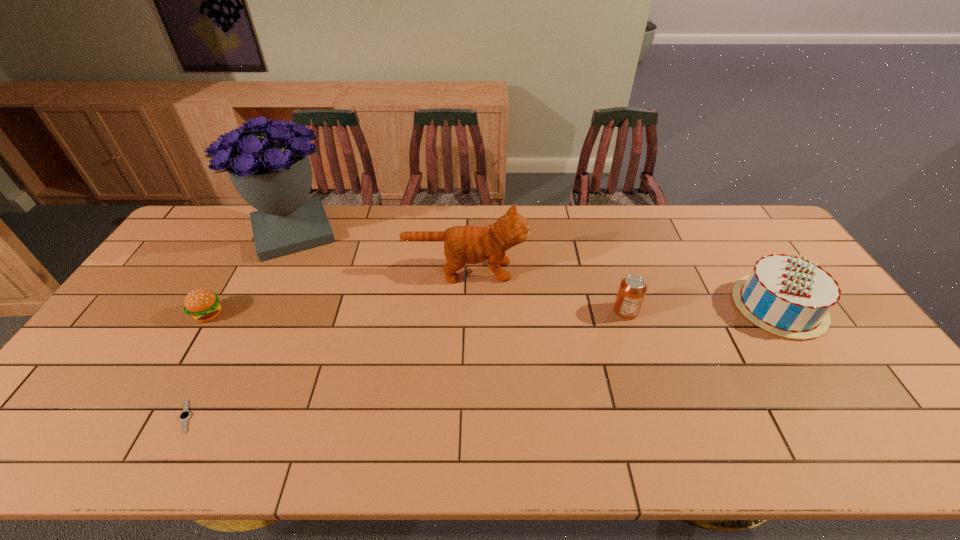
What are the coordinates of `the tallest object` in the screenshot? It's located at coord(272,173).

The height and width of the screenshot is (540, 960). I want to click on the second tallest object, so click(463, 245).

Where is `the third object from right to left`? Image resolution: width=960 pixels, height=540 pixels. the third object from right to left is located at coordinates (463, 245).

What are the coordinates of `the fourth shortest object` in the screenshot? It's located at (788, 296).

Where is `birthday cake`? The height and width of the screenshot is (540, 960). birthday cake is located at coordinates (788, 296).

At what (x,y) coordinates should I click in order to perform the action: click on can. Please return your answer as a coordinate pair (x, y). Image resolution: width=960 pixels, height=540 pixels. Looking at the image, I should click on (632, 290).

Where is `the fourth tallest object`? the fourth tallest object is located at coordinates (632, 290).

Find the location of a particular element. The height and width of the screenshot is (540, 960). the fifth tallest object is located at coordinates (202, 304).

Locate an element on the screen. watch is located at coordinates (184, 416).

Locate an element on the screen. The height and width of the screenshot is (540, 960). the shortest object is located at coordinates click(x=184, y=416).